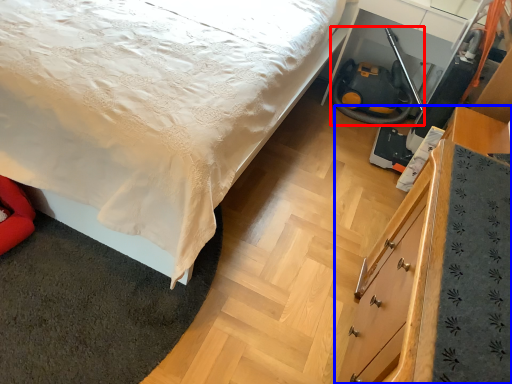
Question: Which object is closer to the camera taking this photo, fire hose (highlighted by a red box) or chest of drawers (highlighted by a blue box)?

Choices:
 (A) fire hose
 (B) chest of drawers

Answer: (B)